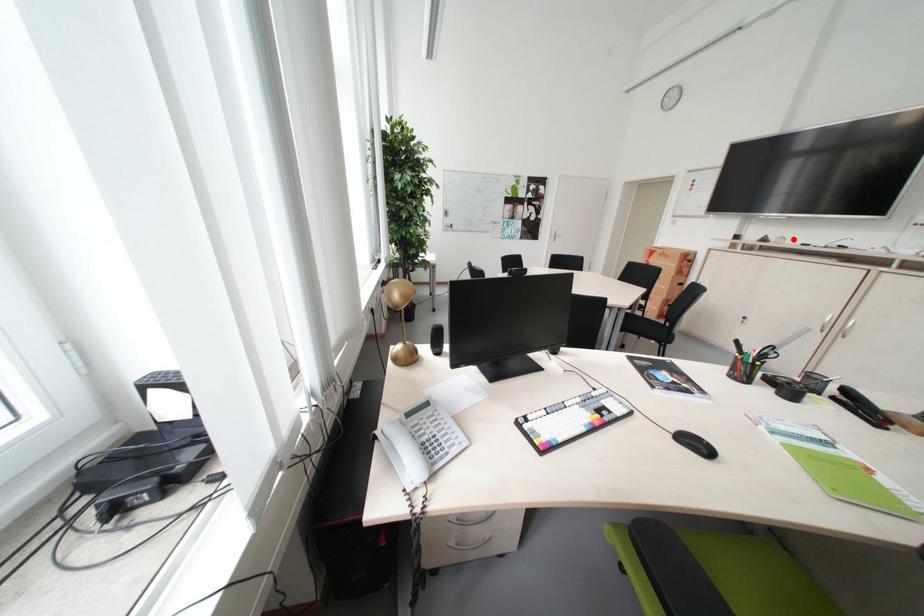
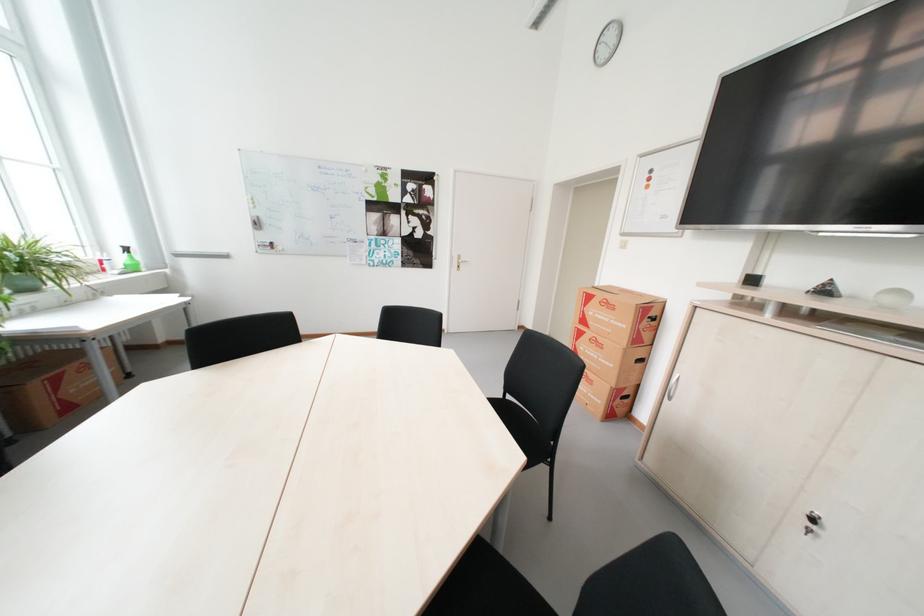
Find the pixel in the second image that matches the highlighted location in the first image.

(910, 294)